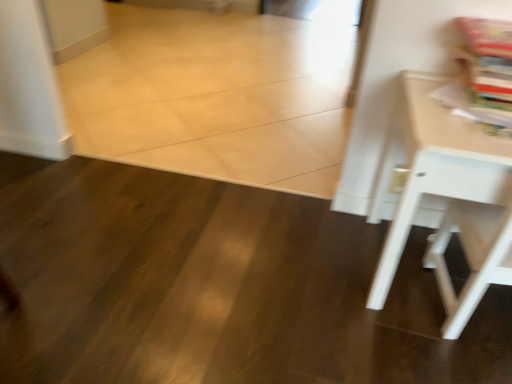
Identify the location of vacant space that is to the left of white matte table at right. This screenshot has width=512, height=384. (306, 269).